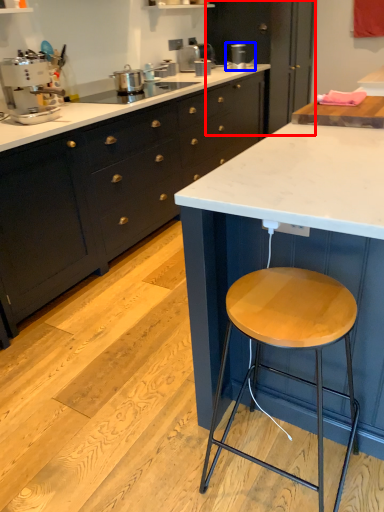
Question: Among these objects, which one is farthest to the camera, cabinetry (highlighted by a red box) or appliance (highlighted by a blue box)?

Choices:
 (A) cabinetry
 (B) appliance

Answer: (A)